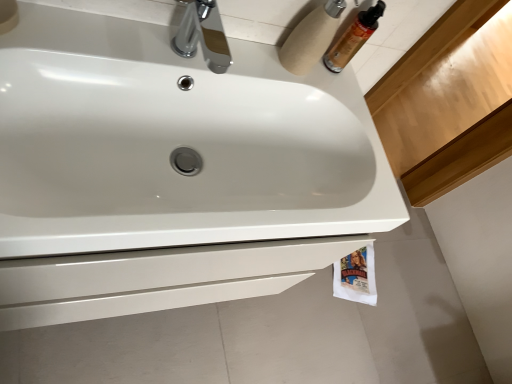
Describe the element at coordinates (175, 143) in the screenshot. This screenshot has width=512, height=384. I see `white glossy sink at center` at that location.

Locate an element on the screen. white paper towel at lower right, the first toilet paper ordered from the bottom is located at coordinates (356, 277).

This screenshot has width=512, height=384. Describe the element at coordinates (356, 277) in the screenshot. I see `white paper towel at lower right, acting as the first toilet paper starting from the back` at that location.

Locate an element on the screen. white cardboard toilet paper at upper right, placed as the second toilet paper when sorted from bottom to top is located at coordinates (311, 37).

Find the location of a particular element. translucent plastic mouthwash at upper right is located at coordinates (353, 38).

What's the angular difference between white glossy sink at center and white paper towel at lower right, acting as the first toilet paper starting from the back,'s facing directions?

The facing directions of white glossy sink at center and white paper towel at lower right, acting as the first toilet paper starting from the back, are 18.9 degrees apart.

In terms of width, does white glossy sink at center look wider or thinner when compared to white paper towel at lower right, arranged as the second toilet paper when viewed from the top?

Considering their sizes, white glossy sink at center looks broader than white paper towel at lower right, arranged as the second toilet paper when viewed from the top.

Between white glossy sink at center and white paper towel at lower right, acting as the first toilet paper starting from the back, which one has more height?

white glossy sink at center.

The width and height of the screenshot is (512, 384). I want to click on sink above the white paper towel at lower right, the first toilet paper ordered from the bottom (from a real-world perspective), so click(x=175, y=143).

Is white paper towel at lower right, arranged as the second toilet paper when viewed from the left, oriented away from translucent plastic mouthwash at upper right?

No, translucent plastic mouthwash at upper right is not at the back of white paper towel at lower right, arranged as the second toilet paper when viewed from the left.

Is white paper towel at lower right, marked as the second toilet paper in a front-to-back arrangement, positioned far away from translucent plastic mouthwash at upper right?

Yes, white paper towel at lower right, marked as the second toilet paper in a front-to-back arrangement, and translucent plastic mouthwash at upper right are located far from each other.

Which is less distant, (340, 281) or (366, 15)?

The point (366, 15) is closer.

Between white paper towel at lower right, arranged as the second toilet paper when viewed from the top, and translucent plastic mouthwash at upper right, which one appears on the right side from the viewer's perspective?

white paper towel at lower right, arranged as the second toilet paper when viewed from the top.

Are chrome metallic faucet at upper center and translucent plastic mouthwash at upper right located far from each other?

That's not correct — chrome metallic faucet at upper center is a little close to translucent plastic mouthwash at upper right.

From the image's perspective, is chrome metallic faucet at upper center located beneath translucent plastic mouthwash at upper right?

Correct, chrome metallic faucet at upper center appears lower than translucent plastic mouthwash at upper right in the image.

Which is closer, (x=225, y=45) or (x=368, y=13)?

Point (x=225, y=45).

Who is bigger, chrome metallic faucet at upper center or translucent plastic mouthwash at upper right?

With larger size is chrome metallic faucet at upper center.

Is white cardboard toilet paper at upper right, arranged as the 1th toilet paper when viewed from the front, in front of translucent plastic mouthwash at upper right?

Yes, it is in front of translucent plastic mouthwash at upper right.

From the image's perspective, relative to translucent plastic mouthwash at upper right, is white cardboard toilet paper at upper right, the 1th toilet paper from the left, above or below?

Based on their image positions, white cardboard toilet paper at upper right, the 1th toilet paper from the left, is located beneath translucent plastic mouthwash at upper right.

Is white cardboard toilet paper at upper right, placed as the second toilet paper when sorted from bottom to top, far away from translucent plastic mouthwash at upper right?

They are positioned close to each other.

Does white cardboard toilet paper at upper right, placed as the 2th toilet paper when sorted from back to front, have a lesser width compared to translucent plastic mouthwash at upper right?

In fact, white cardboard toilet paper at upper right, placed as the 2th toilet paper when sorted from back to front, might be wider than translucent plastic mouthwash at upper right.

From the picture: Considering the positions of objects translucent plastic mouthwash at upper right and white cardboard toilet paper at upper right, which is the 2th toilet paper from right to left, in the image provided, who is more to the left, translucent plastic mouthwash at upper right or white cardboard toilet paper at upper right, which is the 2th toilet paper from right to left,?

white cardboard toilet paper at upper right, which is the 2th toilet paper from right to left, is more to the left.

Is translucent plastic mouthwash at upper right oriented towards white cardboard toilet paper at upper right, which is the 1th toilet paper in top-to-bottom order?

No.

Considering the sizes of translucent plastic mouthwash at upper right and white cardboard toilet paper at upper right, placed as the second toilet paper when sorted from bottom to top, in the image, is translucent plastic mouthwash at upper right taller or shorter than white cardboard toilet paper at upper right, placed as the second toilet paper when sorted from bottom to top,?

Considering their sizes, translucent plastic mouthwash at upper right has less height than white cardboard toilet paper at upper right, placed as the second toilet paper when sorted from bottom to top.

Is white glossy sink at center looking in the opposite direction of white cardboard toilet paper at upper right, placed as the 2th toilet paper when sorted from back to front?

No.

The width and height of the screenshot is (512, 384). I want to click on sink lying below the white cardboard toilet paper at upper right, the 1th toilet paper from the left (from the image's perspective), so click(x=175, y=143).

Which of these two, white glossy sink at center or white cardboard toilet paper at upper right, the 1th toilet paper from the left, is thinner?

Thinner between the two is white cardboard toilet paper at upper right, the 1th toilet paper from the left.

Is white cardboard toilet paper at upper right, placed as the second toilet paper when sorted from bottom to top, further to camera compared to white glossy sink at center?

Yes.

Does white cardboard toilet paper at upper right, arranged as the 1th toilet paper when viewed from the front, turn towards white glossy sink at center?

No.

Would you say white cardboard toilet paper at upper right, arranged as the 1th toilet paper when viewed from the front, is inside or outside white glossy sink at center?

The correct answer is: outside.

Locate an element on the screen. The height and width of the screenshot is (384, 512). toilet paper directly beneath the white glossy sink at center (from a real-world perspective) is located at coordinates (356, 277).

I want to click on toilet paper behind the translucent plastic mouthwash at upper right, so click(356, 277).

Which object lies further to the anchor point white cardboard toilet paper at upper right, placed as the 2th toilet paper when sorted from back to front, white paper towel at lower right, arranged as the second toilet paper when viewed from the top, or chrome metallic faucet at upper center?

The object further to white cardboard toilet paper at upper right, placed as the 2th toilet paper when sorted from back to front, is white paper towel at lower right, arranged as the second toilet paper when viewed from the top.

Considering their positions, is translucent plastic mouthwash at upper right positioned further to white paper towel at lower right, arranged as the second toilet paper when viewed from the left, than white cardboard toilet paper at upper right, which is the 2th toilet paper from right to left?

The object further to white paper towel at lower right, arranged as the second toilet paper when viewed from the left, is white cardboard toilet paper at upper right, which is the 2th toilet paper from right to left.

Estimate the real-world distances between objects in this image. Which object is closer to white cardboard toilet paper at upper right, placed as the 2th toilet paper when sorted from back to front, white glossy sink at center or chrome metallic faucet at upper center?

The object closer to white cardboard toilet paper at upper right, placed as the 2th toilet paper when sorted from back to front, is chrome metallic faucet at upper center.

Considering their positions, is white glossy sink at center positioned closer to translucent plastic mouthwash at upper right than chrome metallic faucet at upper center?

chrome metallic faucet at upper center.

When comparing their distances from white paper towel at lower right, acting as the first toilet paper starting from the back, does white cardboard toilet paper at upper right, placed as the second toilet paper when sorted from bottom to top, or white glossy sink at center seem further?

white cardboard toilet paper at upper right, placed as the second toilet paper when sorted from bottom to top.

Consider the image. Considering their positions, is white cardboard toilet paper at upper right, the 1th toilet paper from the left, positioned further to translucent plastic mouthwash at upper right than chrome metallic faucet at upper center?

Based on the image, chrome metallic faucet at upper center appears to be further to translucent plastic mouthwash at upper right.

Estimate the real-world distances between objects in this image. Which object is further from translucent plastic mouthwash at upper right, chrome metallic faucet at upper center or white paper towel at lower right, arranged as the second toilet paper when viewed from the top?

white paper towel at lower right, arranged as the second toilet paper when viewed from the top, is positioned further to the anchor translucent plastic mouthwash at upper right.

Estimate the real-world distances between objects in this image. Which object is closer to white glossy sink at center, chrome metallic faucet at upper center or white paper towel at lower right, the 1th toilet paper when ordered from right to left?

The object closer to white glossy sink at center is chrome metallic faucet at upper center.

You are a GUI agent. You are given a task and a screenshot of the screen. Output one action in this format:
    pyautogui.click(x=<x>, y=<y>)
    Task: Click on the sink between chrome metallic faucet at upper center and translucent plastic mouthwash at upper right
    The height and width of the screenshot is (384, 512).
    Given the screenshot: What is the action you would take?
    pyautogui.click(x=175, y=143)

Find the location of a particular element. This screenshot has width=512, height=384. mouthwash positioned between chrome metallic faucet at upper center and white paper towel at lower right, arranged as the second toilet paper when viewed from the top, from near to far is located at coordinates (353, 38).

Locate an element on the screen. The image size is (512, 384). toilet paper between white glossy sink at center and white paper towel at lower right, arranged as the second toilet paper when viewed from the top, from front to back is located at coordinates (311, 37).

Locate an element on the screen. This screenshot has width=512, height=384. mouthwash between white glossy sink at center and white paper towel at lower right, arranged as the second toilet paper when viewed from the top, along the z-axis is located at coordinates (353, 38).